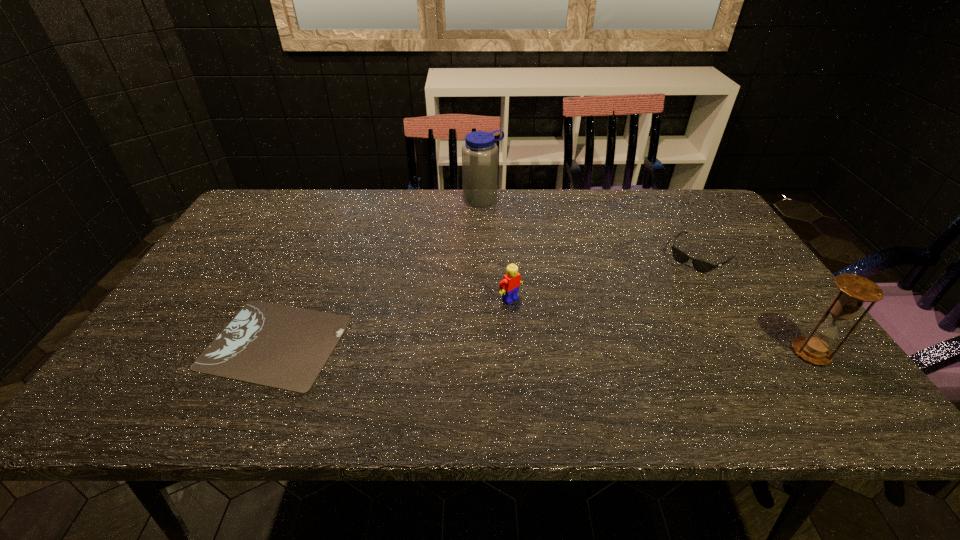
Find the location of a particular element. The height and width of the screenshot is (540, 960). mousepad is located at coordinates (284, 347).

You are a GUI agent. You are given a task and a screenshot of the screen. Output one action in this format:
    pyautogui.click(x=<x>, y=<y>)
    Task: Click on the leftmost object
    
    Given the screenshot: What is the action you would take?
    pyautogui.click(x=284, y=347)

Find the location of a particular element. The image size is (960, 540). hourglass is located at coordinates (855, 290).

You are a GUI agent. You are given a task and a screenshot of the screen. Output one action in this format:
    pyautogui.click(x=<x>, y=<y>)
    Task: Click on the second farthest object
    
    Given the screenshot: What is the action you would take?
    pyautogui.click(x=702, y=266)

Where is `sunglasses`? This screenshot has height=540, width=960. sunglasses is located at coordinates (702, 266).

Image resolution: width=960 pixels, height=540 pixels. Identify the location of water bottle. (479, 153).

Identify the location of Lego. (509, 286).

In order to click on vacant position located 0.090m on the left of the mousepad in this screenshot , I will do `click(167, 342)`.

At what (x,y) coordinates should I click in order to perform the action: click on blank area located 0.150m on the back of the hourglass. Please return your answer as a coordinate pair (x, y). Image resolution: width=960 pixels, height=540 pixels. Looking at the image, I should click on (769, 294).

In order to click on free space located on the front-facing side of the second shortest object in this screenshot , I will do `click(636, 319)`.